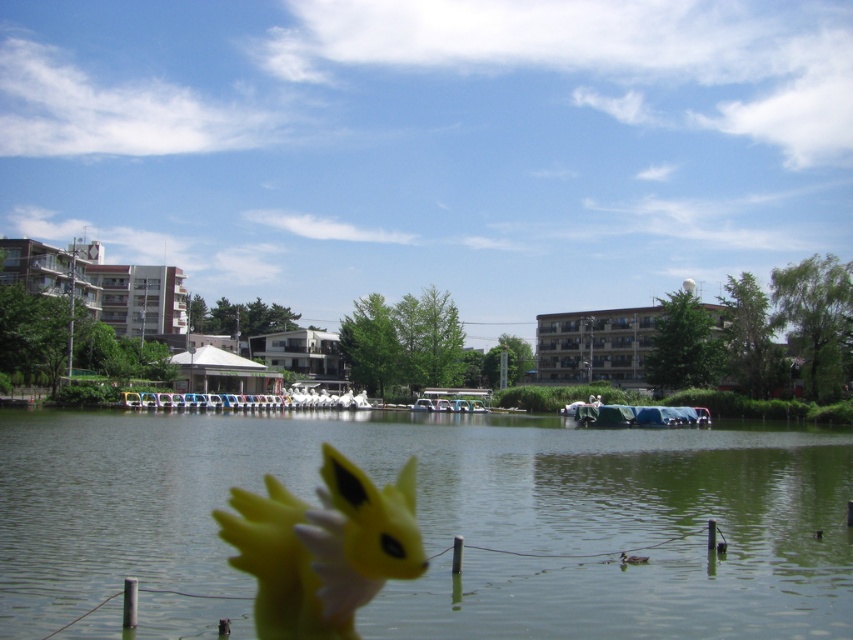
Question: Which point is closer to the camera?

Choices:
 (A) (111, 564)
 (B) (354, 541)

Answer: (B)

Question: Does green smooth water at center appear on the right side of yellow matte toy at center?

Choices:
 (A) yes
 (B) no

Answer: (A)

Question: Does green smooth water at center appear over yellow matte toy at center?

Choices:
 (A) yes
 (B) no

Answer: (B)

Question: Among these points, which one is farthest from the camera?

Choices:
 (A) (321, 512)
 (B) (544, 564)

Answer: (B)

Question: Can you confirm if green smooth water at center is positioned above yellow matte toy at center?

Choices:
 (A) no
 (B) yes

Answer: (A)